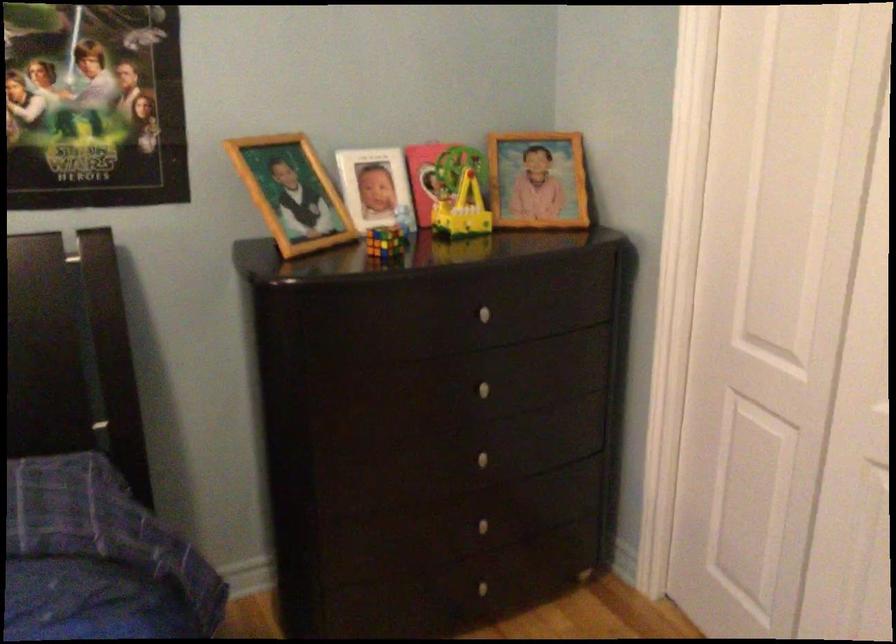
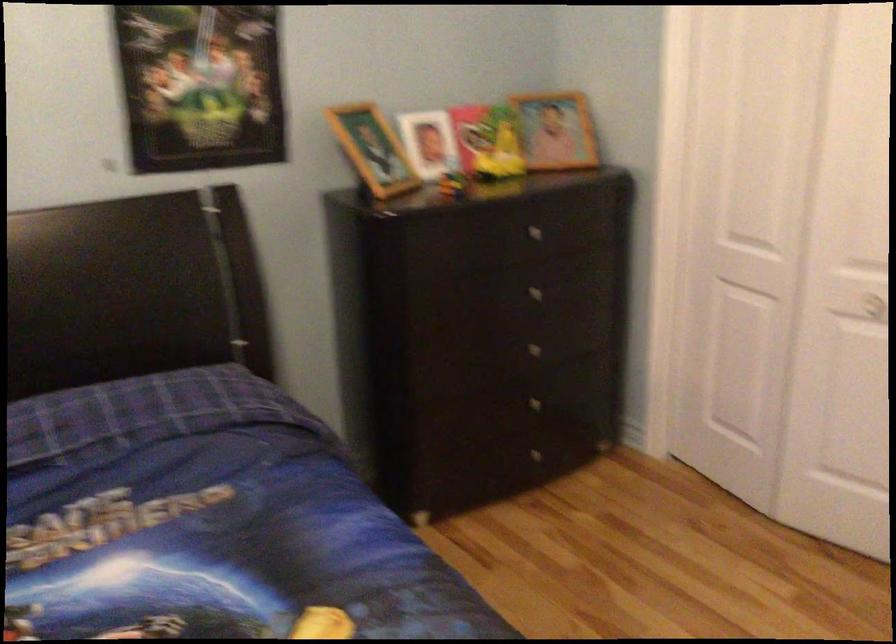
The point at (297, 196) is marked in the first image. Where is the corresponding point in the second image?

(373, 149)